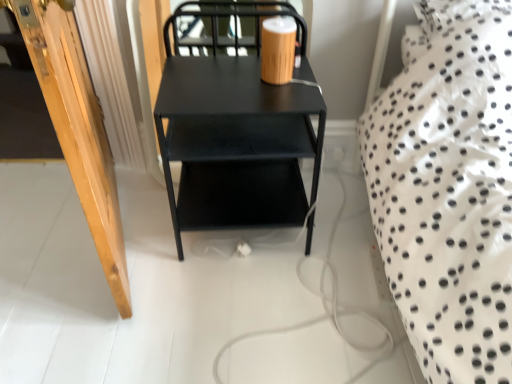
This screenshot has height=384, width=512. Identify the location of space that is in front of matte black table at center. (252, 308).